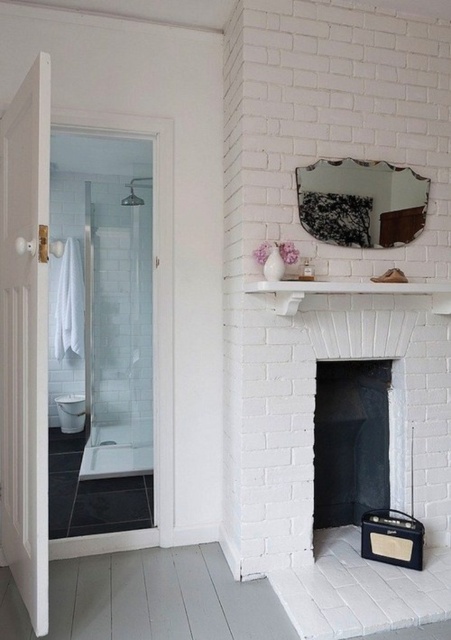
Looking at this image, you are standing in the bathroom and want to reach the two points marked in the scene. Which point, point (350, 291) or point (142, 186), is closer to you?

Point (350, 291) is closer to you than point (142, 186).

You are moving a small box that is 10 cm in width. You need to place it on either the matte black radio at lower right or the brushed metal shower at upper left. Which object can it fit on?

The matte black radio at lower right is bigger than the brushed metal shower at upper left, so the small box that is 10 cm in width can fit on the matte black radio at lower right.